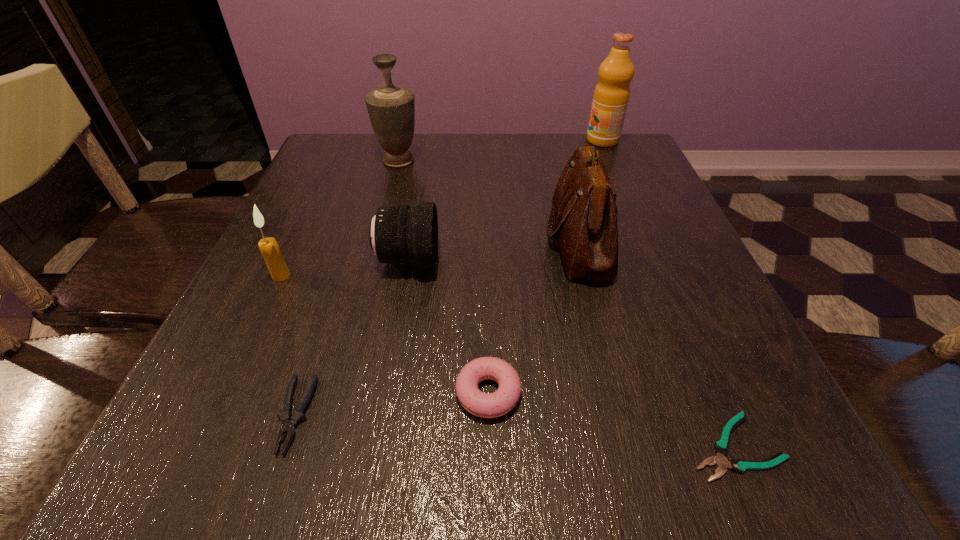
You are a GUI agent. You are given a task and a screenshot of the screen. Output one action in this format:
    pyautogui.click(x=<x>, y=<y>)
    Task: Click on the vacant region located on the back of the third shortest object
    
    Given the screenshot: What is the action you would take?
    pyautogui.click(x=486, y=253)

Where is `free space located on the back of the right pliers`? The image size is (960, 540). free space located on the back of the right pliers is located at coordinates (692, 348).

Where is `fruit juice present at the far edge`? The image size is (960, 540). fruit juice present at the far edge is located at coordinates (611, 95).

Identify the location of urn that is at the far edge. (391, 109).

Where is `doughnut situated at the near edge`? This screenshot has width=960, height=540. doughnut situated at the near edge is located at coordinates (486, 405).

The width and height of the screenshot is (960, 540). I want to click on urn at the left edge, so click(391, 109).

What are the coordinates of `candle situated at the left edge` in the screenshot? It's located at (269, 247).

You are a GUI agent. You are given a task and a screenshot of the screen. Output one action in this format:
    pyautogui.click(x=<x>, y=<y>)
    Task: Click on the pliers that is positioned at the left edge
    This screenshot has height=540, width=960.
    Given the screenshot: What is the action you would take?
    pyautogui.click(x=289, y=421)

Identify the location of fruit juice positioned at the right edge. pos(611,95).

Identify the location of shoulder bag that is at the right edge. The height and width of the screenshot is (540, 960). (584, 212).